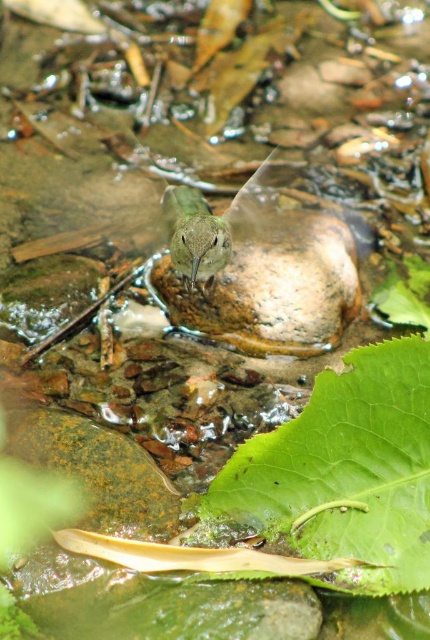
Describe the element at coordinates (344, 472) in the screenshot. I see `green matte leaf at lower center` at that location.

Can you confirm if green matte leaf at lower center is thinner than green matte bird at center?

Incorrect, green matte leaf at lower center's width is not less than green matte bird at center's.

Is point (374, 435) closer to viewer compared to point (215, 244)?

Yes, point (374, 435) is closer to viewer.

What are the coordinates of `green matte leaf at lower center` in the screenshot? It's located at (344, 472).